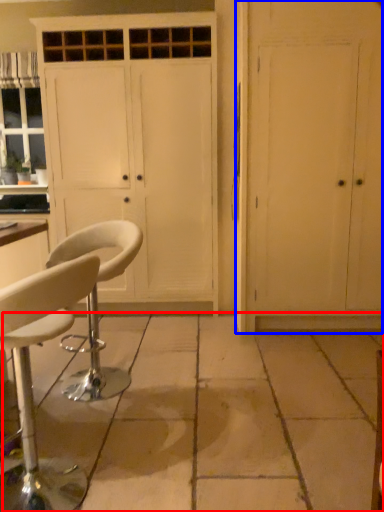
Question: Which object is further to the camera taking this photo, concrete (highlighted by a red box) or door (highlighted by a blue box)?

Choices:
 (A) concrete
 (B) door

Answer: (B)